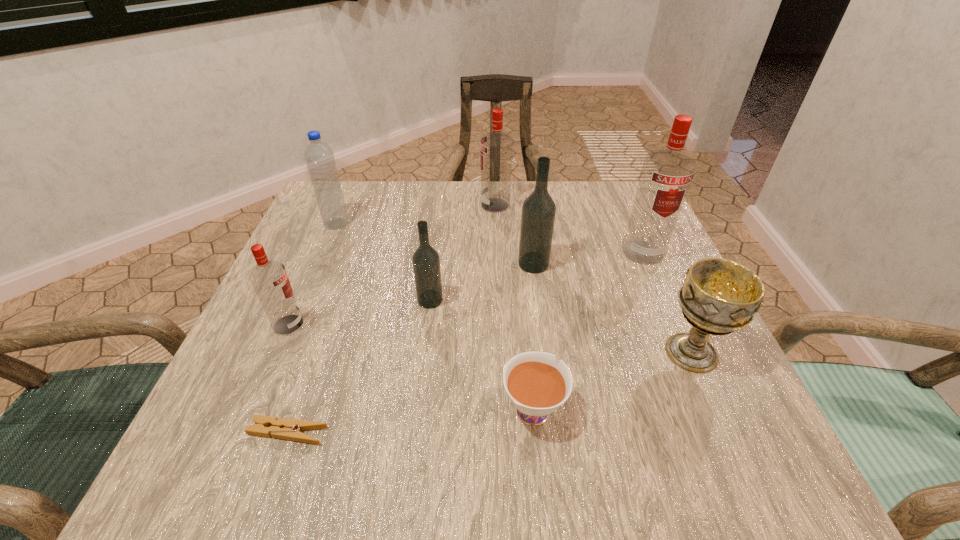
Locate an element on the screen. The image size is (960, 540). the tallest vodka is located at coordinates (666, 175).

Identify the location of the rightmost red vodka. This screenshot has height=540, width=960. (666, 175).

The width and height of the screenshot is (960, 540). What are the coordinates of `the farther black vodka` in the screenshot? It's located at (538, 211).

Locate an element on the screen. the second vodka from right to left is located at coordinates (538, 211).

Find the location of a particular element. the farthest object is located at coordinates (496, 147).

This screenshot has height=540, width=960. What are the coordinates of `the farthest vodka` in the screenshot? It's located at pos(496,147).

Identify the location of water bottle. (319, 157).

This screenshot has width=960, height=540. I want to click on blue water bottle, so click(x=319, y=157).

Image resolution: width=960 pixels, height=540 pixels. Identify the location of the nearest red vodka. (269, 278).

Where is `the leftmost vodka`? The image size is (960, 540). the leftmost vodka is located at coordinates (269, 278).